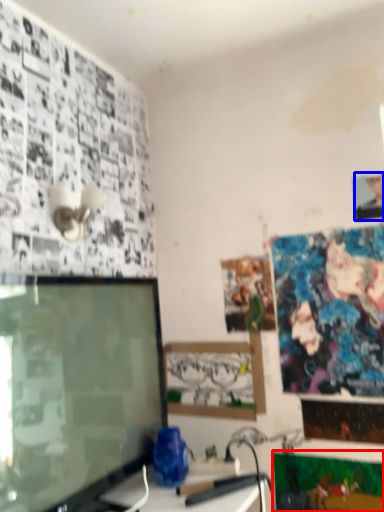
Question: Which object appears closest to the camera in this image, poster page (highlighted by a red box) or person (highlighted by a blue box)?

Choices:
 (A) poster page
 (B) person

Answer: (A)